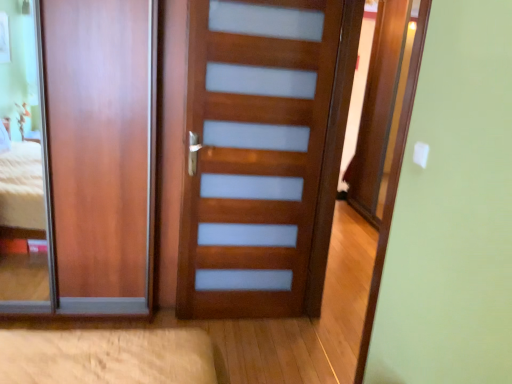
What do you see at coordinates (254, 153) in the screenshot?
I see `wooden door at center, which appears as the 1th door when viewed from the right` at bounding box center [254, 153].

In order to face wooden door at center, which appears as the 1th door when viewed from the right, should I rotate leftwards or rightwards?

Rotate left and turn 0.320 degrees.

At what (x,y) coordinates should I click in order to perform the action: click on wooden door at center, which appears as the 1th door when viewed from the right. Please return your answer as a coordinate pair (x, y). The width and height of the screenshot is (512, 384). Looking at the image, I should click on (254, 153).

The height and width of the screenshot is (384, 512). In order to click on matte wood door at left, placed as the second door when sorted from right to left in this screenshot , I will do `click(101, 150)`.

How much space does matte wood door at left, placed as the second door when sorted from right to left, occupy vertically?

The height of matte wood door at left, placed as the second door when sorted from right to left, is 1.80 meters.

The height and width of the screenshot is (384, 512). What do you see at coordinates (101, 150) in the screenshot? I see `matte wood door at left, the 1th door in the left-to-right sequence` at bounding box center [101, 150].

Locate an element on the screen. This screenshot has height=384, width=512. wooden door at center, which appears as the 1th door when viewed from the right is located at coordinates (254, 153).

Considering the positions of objects wooden door at center, which appears as the 1th door when viewed from the right, and matte wood door at left, the 1th door in the left-to-right sequence, in the image provided, who is more to the left, wooden door at center, which appears as the 1th door when viewed from the right, or matte wood door at left, the 1th door in the left-to-right sequence,?

From the viewer's perspective, matte wood door at left, the 1th door in the left-to-right sequence, appears more on the left side.

Is wooden door at center, which is the second door in left-to-right order, behind matte wood door at left, placed as the second door when sorted from right to left?

No, wooden door at center, which is the second door in left-to-right order, is closer to the camera.

Does point (216, 219) come farther from viewer compared to point (91, 231)?

That is True.

From the image's perspective, relative to matte wood door at left, the 1th door in the left-to-right sequence, is wooden door at center, which is the second door in left-to-right order, above or below?

wooden door at center, which is the second door in left-to-right order, is below matte wood door at left, the 1th door in the left-to-right sequence.

From a real-world perspective, does wooden door at center, which is the second door in left-to-right order, sit lower than matte wood door at left, the 1th door in the left-to-right sequence?

Incorrect, from a real-world perspective, wooden door at center, which is the second door in left-to-right order, is higher than matte wood door at left, the 1th door in the left-to-right sequence.

Which object is thinner, wooden door at center, which appears as the 1th door when viewed from the right, or matte wood door at left, the 1th door in the left-to-right sequence?

matte wood door at left, the 1th door in the left-to-right sequence.

Considering the sizes of objects wooden door at center, which is the second door in left-to-right order, and matte wood door at left, placed as the second door when sorted from right to left, in the image provided, who is shorter, wooden door at center, which is the second door in left-to-right order, or matte wood door at left, placed as the second door when sorted from right to left,?

matte wood door at left, placed as the second door when sorted from right to left, is shorter.

Looking at the image, does wooden door at center, which is the second door in left-to-right order, seem bigger or smaller compared to matte wood door at left, the 1th door in the left-to-right sequence?

Considering their sizes, wooden door at center, which is the second door in left-to-right order, takes up more space than matte wood door at left, the 1th door in the left-to-right sequence.

Would you say matte wood door at left, the 1th door in the left-to-right sequence, is part of wooden door at center, which is the second door in left-to-right order,'s contents?

No, wooden door at center, which is the second door in left-to-right order, does not contain matte wood door at left, the 1th door in the left-to-right sequence.

Is wooden door at center, which appears as the 1th door when viewed from the right, with matte wood door at left, placed as the second door when sorted from right to left?

No, wooden door at center, which appears as the 1th door when viewed from the right, is not touching matte wood door at left, placed as the second door when sorted from right to left.

Could you tell me if wooden door at center, which appears as the 1th door when viewed from the right, is facing matte wood door at left, the 1th door in the left-to-right sequence?

No, wooden door at center, which appears as the 1th door when viewed from the right, is not oriented towards matte wood door at left, the 1th door in the left-to-right sequence.

Find the location of a particular element. The height and width of the screenshot is (384, 512). door on the right of matte wood door at left, placed as the second door when sorted from right to left is located at coordinates (254, 153).

Considering the relative positions of matte wood door at left, the 1th door in the left-to-right sequence, and wooden door at center, which appears as the 1th door when viewed from the right, in the image provided, is matte wood door at left, the 1th door in the left-to-right sequence, to the right of wooden door at center, which appears as the 1th door when viewed from the right, from the viewer's perspective?

Incorrect, matte wood door at left, the 1th door in the left-to-right sequence, is not on the right side of wooden door at center, which appears as the 1th door when viewed from the right.

Which object is further away from the camera taking this photo, matte wood door at left, the 1th door in the left-to-right sequence, or wooden door at center, which is the second door in left-to-right order?

matte wood door at left, the 1th door in the left-to-right sequence, is further away from the camera.

Which is less distant, (134, 97) or (203, 287)?

Point (134, 97)

From the image's perspective, is matte wood door at left, the 1th door in the left-to-right sequence, above wooden door at center, which is the second door in left-to-right order?

Indeed, from the image's perspective, matte wood door at left, the 1th door in the left-to-right sequence, is shown above wooden door at center, which is the second door in left-to-right order.

From a real-world perspective, which object stands above the other?

In real-world perspective, wooden door at center, which appears as the 1th door when viewed from the right, is above.

Considering the sizes of objects matte wood door at left, placed as the second door when sorted from right to left, and wooden door at center, which appears as the 1th door when viewed from the right, in the image provided, who is thinner, matte wood door at left, placed as the second door when sorted from right to left, or wooden door at center, which appears as the 1th door when viewed from the right,?

matte wood door at left, placed as the second door when sorted from right to left.

Is matte wood door at left, placed as the second door when sorted from right to left, shorter than wooden door at center, which is the second door in left-to-right order?

Yes, matte wood door at left, placed as the second door when sorted from right to left, is shorter than wooden door at center, which is the second door in left-to-right order.

Which of these two, matte wood door at left, the 1th door in the left-to-right sequence, or wooden door at center, which appears as the 1th door when viewed from the right, is smaller?

Smaller between the two is matte wood door at left, the 1th door in the left-to-right sequence.

Is matte wood door at left, the 1th door in the left-to-right sequence, not within wooden door at center, which appears as the 1th door when viewed from the right?

Yes, matte wood door at left, the 1th door in the left-to-right sequence, is not within wooden door at center, which appears as the 1th door when viewed from the right.

Are matte wood door at left, placed as the second door when sorted from right to left, and wooden door at center, which is the second door in left-to-right order, beside each other?

matte wood door at left, placed as the second door when sorted from right to left, is not next to wooden door at center, which is the second door in left-to-right order, and they're not touching.

Is matte wood door at left, placed as the second door when sorted from right to left, aimed at wooden door at center, which appears as the 1th door when viewed from the right?

No, matte wood door at left, placed as the second door when sorted from right to left, is not facing towards wooden door at center, which appears as the 1th door when viewed from the right.

What's the angular difference between matte wood door at left, the 1th door in the left-to-right sequence, and wooden door at center, which appears as the 1th door when viewed from the right,'s facing directions?

The angular difference between matte wood door at left, the 1th door in the left-to-right sequence, and wooden door at center, which appears as the 1th door when viewed from the right, is 18.1 degrees.

You are a GUI agent. You are given a task and a screenshot of the screen. Output one action in this format:
    pyautogui.click(x=<x>, y=<y>)
    Task: Click on the door on the left side of wooden door at center, which appears as the 1th door when viewed from the right
    The image size is (512, 384).
    Given the screenshot: What is the action you would take?
    pyautogui.click(x=101, y=150)

You are a GUI agent. You are given a task and a screenshot of the screen. Output one action in this format:
    pyautogui.click(x=<x>, y=<y>)
    Task: Click on the door that appears below the wooden door at center, which appears as the 1th door when viewed from the right (from a real-world perspective)
    
    Given the screenshot: What is the action you would take?
    pyautogui.click(x=101, y=150)

This screenshot has height=384, width=512. I want to click on door located below the matte wood door at left, placed as the second door when sorted from right to left (from the image's perspective), so click(x=254, y=153).